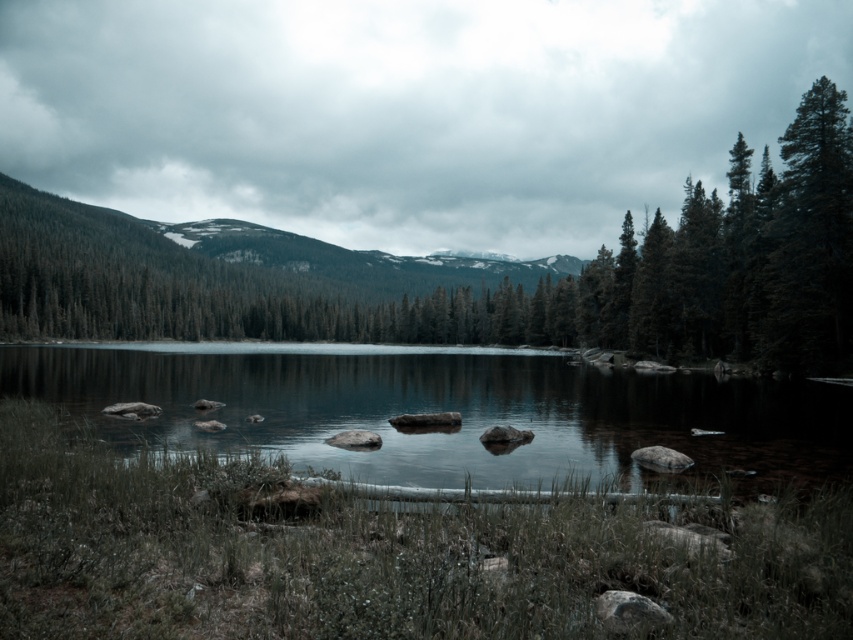
Question: Which point appears farthest from the camera in this image?

Choices:
 (A) (747, 480)
 (B) (33, 227)

Answer: (B)

Question: Which point appears closest to the camera in this image?

Choices:
 (A) (810, 460)
 (B) (369, 292)

Answer: (A)

Question: Can you confirm if green matte tree at center is wider than clear water at center?

Choices:
 (A) no
 (B) yes

Answer: (B)

Question: Does green matte tree at center appear under clear water at center?

Choices:
 (A) yes
 (B) no

Answer: (B)

Question: Is green matte tree at center further to camera compared to clear water at center?

Choices:
 (A) no
 (B) yes

Answer: (B)

Question: Which object appears farthest from the camera in this image?

Choices:
 (A) green matte tree at center
 (B) clear water at center

Answer: (A)